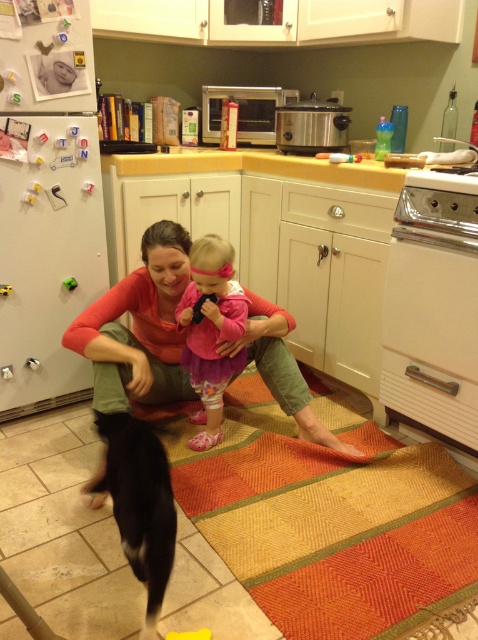
Question: Among these points, which one is farthest from the camera?

Choices:
 (A) (208, 262)
 (B) (159, 310)

Answer: (B)

Question: Does matte orange shirt at center have a lesser width compared to pink satin dress at center?

Choices:
 (A) no
 (B) yes

Answer: (A)

Question: Among these points, which one is farthest from the camera?

Choices:
 (A) (218, 280)
 (B) (97, 358)

Answer: (A)

Question: From the image, what is the correct spatial relationship of matte orange shirt at center in relation to pink satin dress at center?

Choices:
 (A) above
 (B) below

Answer: (B)

Question: Can you confirm if matte orange shirt at center is thinner than pink satin dress at center?

Choices:
 (A) yes
 (B) no

Answer: (B)